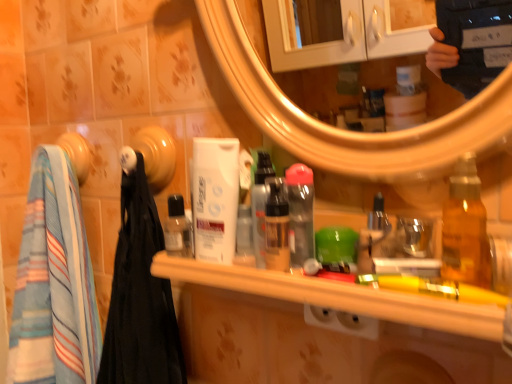
Question: Should I look upward or downward to see striped cotton towel at left?

Choices:
 (A) up
 (B) down

Answer: (B)

Question: Is transparent plastic bottle at center, the 1th mouthwash when ordered from right to left, turned away from translucent amber bottle at right, the second bottle in the back-to-front sequence?

Choices:
 (A) no
 (B) yes

Answer: (A)

Question: From a real-world perspective, is transparent plastic bottle at center, arranged as the fourth mouthwash when viewed from the left, on top of translucent amber bottle at right, the second bottle in the back-to-front sequence?

Choices:
 (A) no
 (B) yes

Answer: (A)

Question: Is translucent amber bottle at right, positioned as the second bottle in left-to-right order, a part of transparent plastic bottle at center, the 1th mouthwash when ordered from right to left?

Choices:
 (A) yes
 (B) no

Answer: (B)

Question: Is transparent plastic bottle at center, the 1th mouthwash when ordered from right to left, facing towards translucent amber bottle at right, the 1th bottle positioned from the right?

Choices:
 (A) yes
 (B) no

Answer: (B)

Question: Would you say transparent plastic bottle at center, the 1th mouthwash when ordered from right to left, is a long distance from translucent amber bottle at right, acting as the 1th bottle starting from the front?

Choices:
 (A) no
 (B) yes

Answer: (A)

Question: From the image's perspective, is transparent plastic bottle at center, arranged as the fourth mouthwash when viewed from the left, above translucent amber bottle at right, the second bottle in the back-to-front sequence?

Choices:
 (A) no
 (B) yes

Answer: (B)

Question: Is wooden shelf at center facing away from transparent plastic bottle at center, the 1th mouthwash when ordered from right to left?

Choices:
 (A) yes
 (B) no

Answer: (B)

Question: From the image's perspective, is wooden shelf at center located above transparent plastic bottle at center, the 1th mouthwash when ordered from right to left?

Choices:
 (A) yes
 (B) no

Answer: (B)

Question: Can you confirm if wooden shelf at center is thinner than transparent plastic bottle at center, arranged as the fourth mouthwash when viewed from the left?

Choices:
 (A) no
 (B) yes

Answer: (A)

Question: Is wooden shelf at center directly adjacent to transparent plastic bottle at center, the 1th mouthwash when ordered from right to left?

Choices:
 (A) yes
 (B) no

Answer: (B)

Question: Does wooden shelf at center turn towards transparent plastic bottle at center, arranged as the fourth mouthwash when viewed from the left?

Choices:
 (A) no
 (B) yes

Answer: (A)

Question: Considering the relative sizes of wooden shelf at center and transparent plastic bottle at center, the 1th mouthwash when ordered from right to left, in the image provided, is wooden shelf at center smaller than transparent plastic bottle at center, the 1th mouthwash when ordered from right to left,?

Choices:
 (A) yes
 (B) no

Answer: (B)

Question: Is white matte mouthwash at center, the 2th mouthwash in the left-to-right sequence, not near striped cotton towel at left?

Choices:
 (A) no
 (B) yes

Answer: (A)